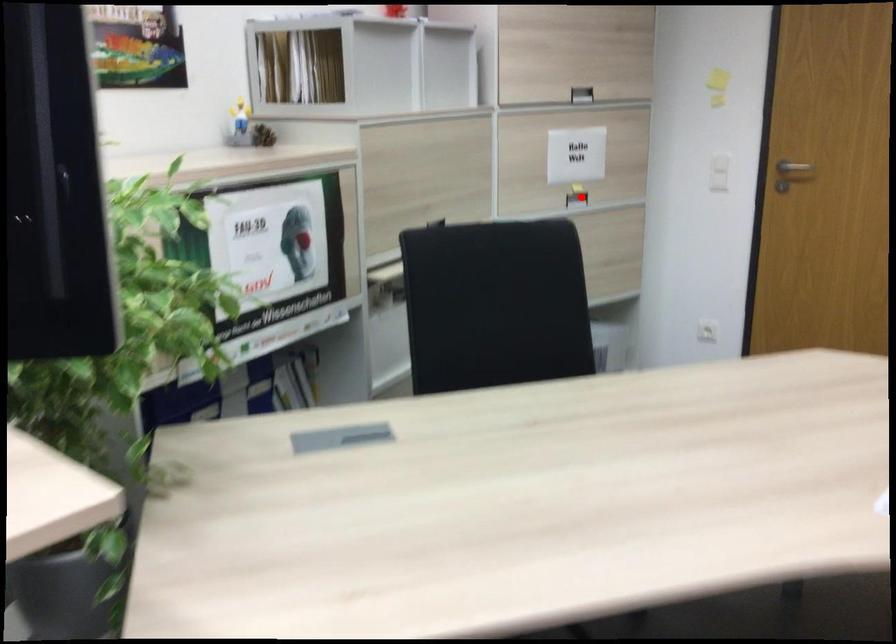
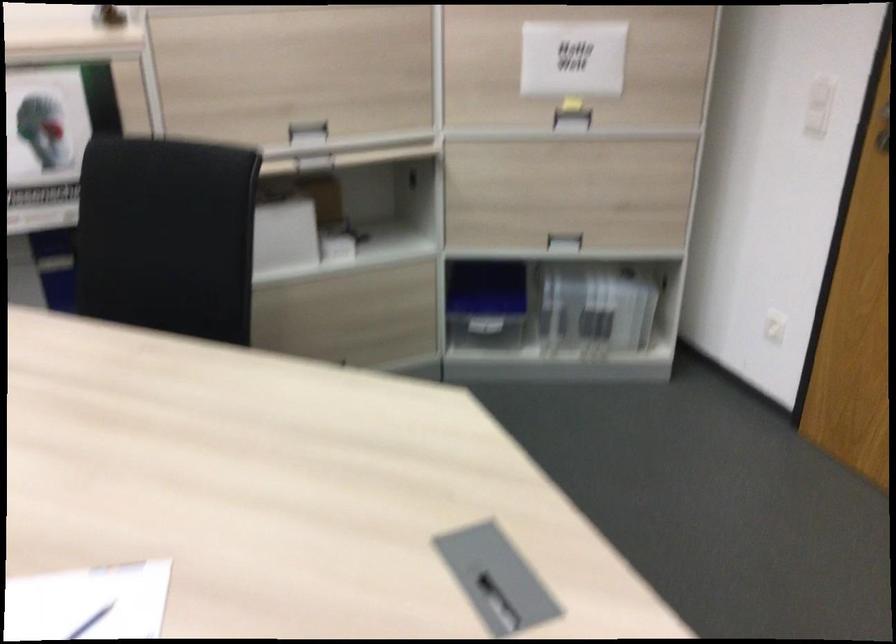
Question: I am providing you with two images of the same scene from different viewpoints. A red point is shown in image1. For the corresponding object point in image2, is it positioned nearer or farther from the camera?

Choices:
 (A) Nearer
 (B) Farther

Answer: (A)